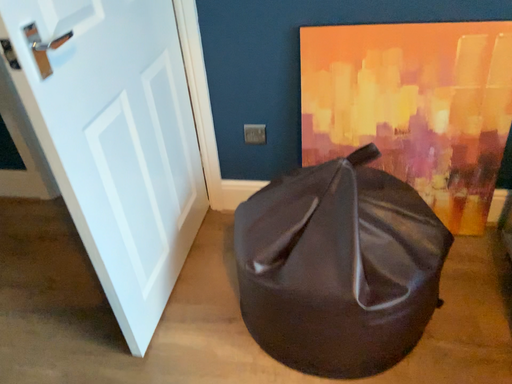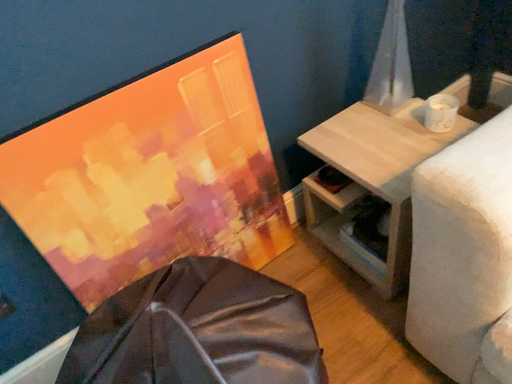
Question: How did the camera likely rotate when shooting the video?

Choices:
 (A) rotated right
 (B) rotated left

Answer: (A)